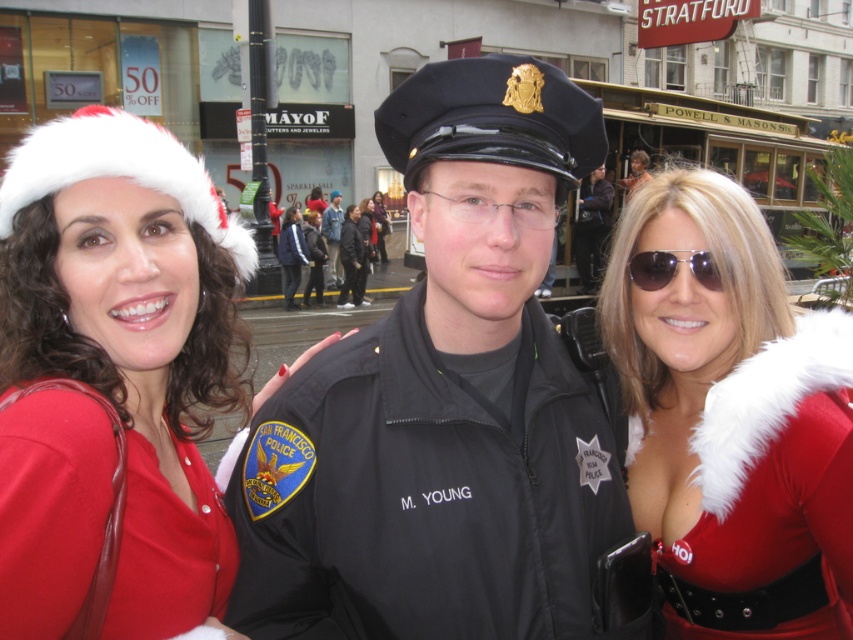
Measure the distance from white fuzzy santa hat at left to shiny silver hair at center.

They are 8.29 meters apart.

Is point (3, 189) farther from viewer compared to point (637, 177)?

No, (3, 189) is closer to viewer.

This screenshot has height=640, width=853. What are the coordinates of `white fuzzy santa hat at left` in the screenshot? It's located at [x=119, y=172].

Does matte red dress at center have a lesser width compared to white fuzzy santa hat at left?

Yes.

Is point (181, 378) less distant than point (113, 147)?

That is False.

Where is `matte red dress at center`? This screenshot has width=853, height=640. matte red dress at center is located at coordinates (115, 378).

Which is above, sunglasses at center or dark blue uniform at center?

dark blue uniform at center is above.

Consider the image. Can you confirm if sunglasses at center is taller than dark blue uniform at center?

No, sunglasses at center is not taller than dark blue uniform at center.

The image size is (853, 640). What are the coordinates of `sunglasses at center` in the screenshot? It's located at (671, 268).